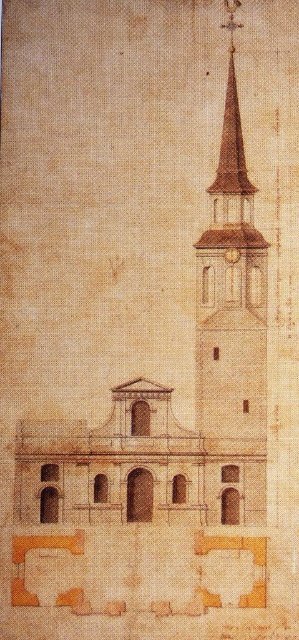
Question: Can you confirm if brown brick bell tower at upper right is positioned to the right of gold textured clock at center?

Choices:
 (A) no
 (B) yes

Answer: (B)

Question: Where is brown brick bell tower at upper right located in relation to gold textured clock at center in the image?

Choices:
 (A) right
 (B) left

Answer: (A)

Question: Among these objects, which one is nearest to the camera?

Choices:
 (A) gold textured clock at center
 (B) brown brick bell tower at upper right

Answer: (B)

Question: Does brown brick bell tower at upper right appear on the left side of gold textured clock at center?

Choices:
 (A) no
 (B) yes

Answer: (A)